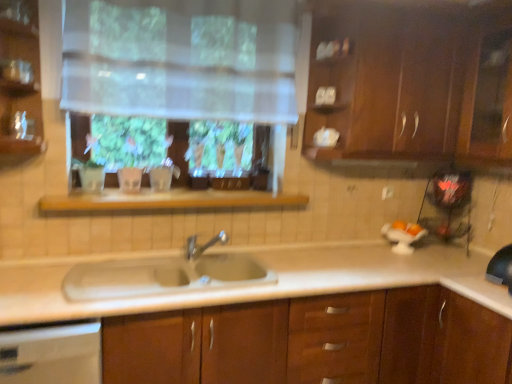
Find the location of a particular element. free space above white glossy dishwasher at lower left (from a real-world perspective) is located at coordinates 39,294.